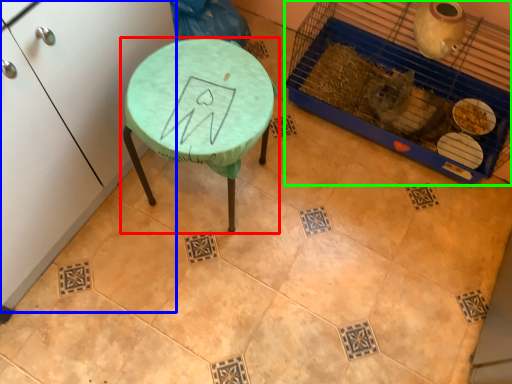
Question: Which object is positioned closest to table (highlighted by a red box)? Select from furniture (highlighted by a blue box) and bird cage (highlighted by a green box).

Choices:
 (A) furniture
 (B) bird cage

Answer: (A)